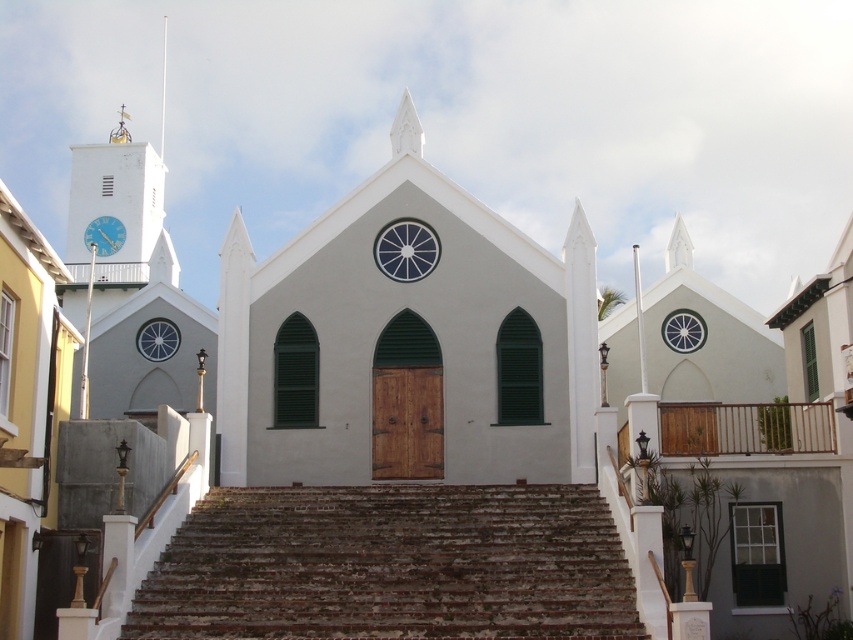
Question: Is metallic blue clock at upper left to the right of smooth white spire at upper center from the viewer's perspective?

Choices:
 (A) yes
 (B) no

Answer: (A)

Question: Which object is closer to the camera taking this photo?

Choices:
 (A) metallic blue clock at upper left
 (B) matte blue glass clock at center
 (C) brown stone stairs at center
 (D) matte glass clock at left

Answer: (C)

Question: Which object is positioned closest to the smooth white spire at upper center?

Choices:
 (A) white glass clock at upper center
 (B) matte blue glass clock at center
 (C) matte glass clock at left

Answer: (C)

Question: Is matte blue glass clock at center to the right of smooth white spire at upper center from the viewer's perspective?

Choices:
 (A) no
 (B) yes

Answer: (B)

Question: Which object is farther from the camera taking this photo?

Choices:
 (A) white glass clock at upper center
 (B) smooth white spire at upper center
 (C) matte blue glass clock at center
 (D) brown stone stairs at center

Answer: (B)

Question: Is matte blue glass clock at center to the left of smooth white spire at upper center from the viewer's perspective?

Choices:
 (A) yes
 (B) no

Answer: (B)